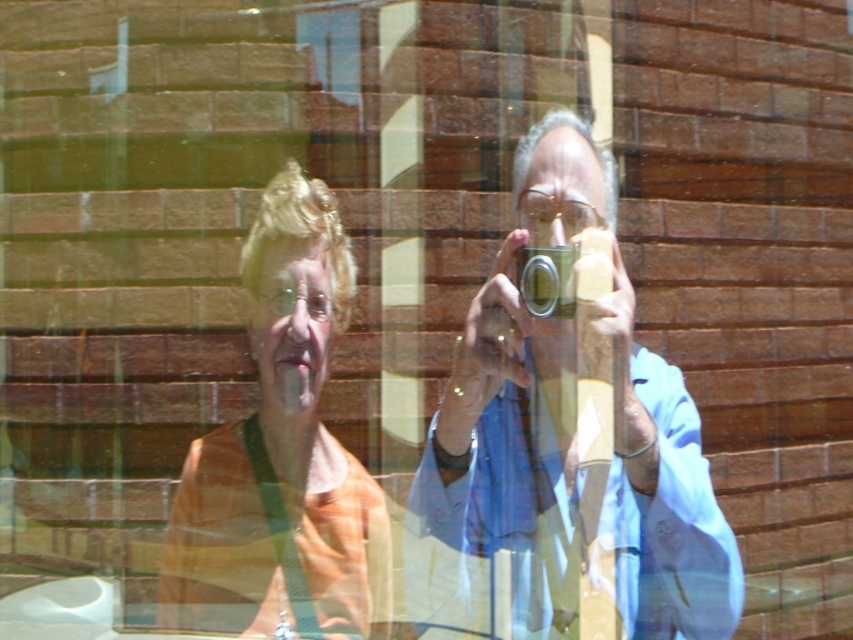
Question: Which object appears closest to the camera in this image?

Choices:
 (A) silver metallic camera at center
 (B) orange fabric at center
 (C) matte blue shirt at center

Answer: (C)

Question: Can you confirm if matte blue shirt at center is smaller than silver metallic camera at center?

Choices:
 (A) yes
 (B) no

Answer: (B)

Question: Can you confirm if orange fabric at center is positioned to the right of silver metallic camera at center?

Choices:
 (A) no
 (B) yes

Answer: (A)

Question: Among these points, which one is farthest from the camera?

Choices:
 (A) (524, 246)
 (B) (341, 472)

Answer: (B)

Question: Which point is farther to the camera?

Choices:
 (A) matte blue shirt at center
 (B) orange fabric at center
 (C) silver metallic camera at center

Answer: (B)

Question: Is matte blue shirt at center to the right of orange fabric at center from the viewer's perspective?

Choices:
 (A) no
 (B) yes

Answer: (B)